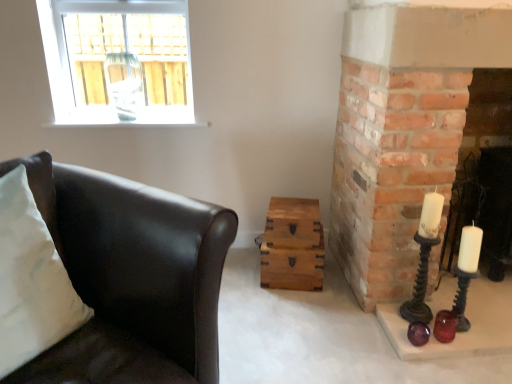
Find the location of a particular element. Image resolution: width=512 pixels, height=384 pixels. matte black leather couch at left is located at coordinates (131, 277).

Looking at this image, what is the approximate width of matte black leather couch at left?

matte black leather couch at left is 1.06 meters wide.

Describe the element at coordinates (31, 280) in the screenshot. I see `white soft cushion at left` at that location.

I want to click on translucent amber glass candle holder at lower right, which appears as the second candle holder when viewed from the top, so click(445, 326).

Locate an element on the screen. The width and height of the screenshot is (512, 384). transparent glass window at upper left is located at coordinates (118, 61).

At what (x,y) coordinates should I click in order to perform the action: click on matte black leather couch at left. Please return your answer as a coordinate pair (x, y). Looking at the image, I should click on pyautogui.click(x=131, y=277).

Is smooth brick fireplace at right smaller than transparent glass window at upper left?

No, smooth brick fireplace at right is not smaller than transparent glass window at upper left.

Is smooth brick fireplace at right not inside transparent glass window at upper left?

smooth brick fireplace at right lies outside transparent glass window at upper left's area.

The image size is (512, 384). I want to click on window on the left of smooth brick fireplace at right, so click(118, 61).

From a real-world perspective, between smooth brick fireplace at right and transparent glass window at upper left, who is vertically lower?

From a 3D spatial view, smooth brick fireplace at right is below.

From the image's perspective, between transparent glass window at upper left and white soft cushion at left, which one is located above?

transparent glass window at upper left appears higher in the image.

Is transparent glass window at upper left directly adjacent to white soft cushion at left?

No, transparent glass window at upper left is not making contact with white soft cushion at left.

Can you confirm if transparent glass window at upper left is positioned to the left of white soft cushion at left?

Indeed, transparent glass window at upper left is positioned on the left side of white soft cushion at left.

From a real-world perspective, is transparent glass window at upper left under white soft cushion at left?

No.

From a real-world perspective, is smooth brick fireplace at right above or below wooden chest at center, the 2th drawer viewed from the top?

Clearly, from a real-world perspective, smooth brick fireplace at right is above wooden chest at center, the 2th drawer viewed from the top.

From the image's perspective, does smooth brick fireplace at right appear lower than wooden chest at center, the 1th drawer in the bottom-to-top sequence?

No, from the image's perspective, smooth brick fireplace at right is not beneath wooden chest at center, the 1th drawer in the bottom-to-top sequence.

Which is more to the left, smooth brick fireplace at right or wooden chest at center, the 2th drawer viewed from the top?

wooden chest at center, the 2th drawer viewed from the top.

Considering the sizes of objects smooth brick fireplace at right and wooden chest at center, the 1th drawer in the bottom-to-top sequence, in the image provided, who is wider, smooth brick fireplace at right or wooden chest at center, the 1th drawer in the bottom-to-top sequence,?

Wider between the two is smooth brick fireplace at right.

Is transparent glass window at upper left at the left side of translucent amber glass candle holder at lower right, which appears as the second candle holder when viewed from the top?

Correct, you'll find transparent glass window at upper left to the left of translucent amber glass candle holder at lower right, which appears as the second candle holder when viewed from the top.

From the image's perspective, does transparent glass window at upper left appear higher than translucent amber glass candle holder at lower right, marked as the 1th candle holder in a bottom-to-top arrangement?

Yes, from the image's perspective, transparent glass window at upper left is over translucent amber glass candle holder at lower right, marked as the 1th candle holder in a bottom-to-top arrangement.

Are transparent glass window at upper left and translucent amber glass candle holder at lower right, which appears as the second candle holder when viewed from the top, making contact?

There is a gap between transparent glass window at upper left and translucent amber glass candle holder at lower right, which appears as the second candle holder when viewed from the top.

From a real-world perspective, is transparent glass window at upper left positioned over translucent amber glass candle holder at lower right, which appears as the second candle holder when viewed from the top, based on gravity?

Yes.

In terms of width, does translucent amber glass candle holder at lower right, marked as the 1th candle holder in a bottom-to-top arrangement, look wider or thinner when compared to matte black leather couch at left?

In the image, translucent amber glass candle holder at lower right, marked as the 1th candle holder in a bottom-to-top arrangement, appears to be more narrow than matte black leather couch at left.

Is translucent amber glass candle holder at lower right, marked as the 1th candle holder in a bottom-to-top arrangement, to the right of matte black leather couch at left from the viewer's perspective?

Indeed, translucent amber glass candle holder at lower right, marked as the 1th candle holder in a bottom-to-top arrangement, is positioned on the right side of matte black leather couch at left.

Does translucent amber glass candle holder at lower right, marked as the 1th candle holder in a bottom-to-top arrangement, have a greater height compared to matte black leather couch at left?

Incorrect, the height of translucent amber glass candle holder at lower right, marked as the 1th candle holder in a bottom-to-top arrangement, is not larger of that of matte black leather couch at left.

Find the location of a particular element. the 2nd candle holder behind when counting from the matte black leather couch at left is located at coordinates (445, 326).

Is matte black leather couch at left a part of smooth brick fireplace at right?

That's incorrect, matte black leather couch at left is not inside smooth brick fireplace at right.

Between smooth brick fireplace at right and matte black leather couch at left, which one has larger size?

Bigger between the two is matte black leather couch at left.

Is matte black leather couch at left at the back of smooth brick fireplace at right?

smooth brick fireplace at right does not have its back to matte black leather couch at left.

Would you say smooth brick fireplace at right is to the left or to the right of matte black leather couch at left in the picture?

smooth brick fireplace at right is to the right of matte black leather couch at left.

Is the surface of wooden chest at center, the 2th drawer viewed from the top, in direct contact with transparent glass window at upper left?

wooden chest at center, the 2th drawer viewed from the top, is not next to transparent glass window at upper left, and they're not touching.

Measure the distance between wooden chest at center, the 2th drawer viewed from the top, and transparent glass window at upper left.

A distance of 1.27 meters exists between wooden chest at center, the 2th drawer viewed from the top, and transparent glass window at upper left.

Is wooden chest at center, the 2th drawer viewed from the top, bigger than transparent glass window at upper left?

Incorrect, wooden chest at center, the 2th drawer viewed from the top, is not larger than transparent glass window at upper left.

Consider the image. Relative to transparent glass window at upper left, is wooden chest at center, the 2th drawer viewed from the top, in front or behind?

wooden chest at center, the 2th drawer viewed from the top, is behind transparent glass window at upper left.

Find the location of a particular element. This screenshot has height=384, width=512. window that appears on the left of smooth brick fireplace at right is located at coordinates (118, 61).

Locate an element on the screen. The image size is (512, 384). window lying above the white soft cushion at left (from the image's perspective) is located at coordinates (118, 61).

When comparing their distances from matte black leather couch at left, does transparent glass window at upper left or translucent amber glass candle holder at lower right, which appears as the second candle holder when viewed from the top, seem further?

transparent glass window at upper left is positioned further to the anchor matte black leather couch at left.

Looking at the image, which one is located further to matte black leather couch at left, transparent glass window at upper left or wooden chest at center, the 1th drawer viewed from the top?

Based on the image, transparent glass window at upper left appears to be further to matte black leather couch at left.

When comparing their distances from matte black leather couch at left, does transparent glass window at upper left or matte black candle holder at right, which is the 2th candle holder from bottom to top, seem further?

Based on the image, transparent glass window at upper left appears to be further to matte black leather couch at left.

From the image, which object appears to be nearer to translucent amber glass candle holder at lower right, which appears as the second candle holder when viewed from the top, matte black candle holder at right, which is the 2th candle holder from bottom to top, or transparent glass window at upper left?

matte black candle holder at right, which is the 2th candle holder from bottom to top.

Based on their spatial positions, is translucent amber glass candle holder at lower right, which appears as the second candle holder when viewed from the top, or white soft cushion at left further from matte black candle holder at right, which is the 2th candle holder from bottom to top?

white soft cushion at left is further to matte black candle holder at right, which is the 2th candle holder from bottom to top.

Consider the image. Considering their positions, is matte black candle holder at right, which is the 2th candle holder from bottom to top, positioned further to transparent glass window at upper left than translucent amber glass candle holder at lower right, marked as the 1th candle holder in a bottom-to-top arrangement?

The object further to transparent glass window at upper left is translucent amber glass candle holder at lower right, marked as the 1th candle holder in a bottom-to-top arrangement.

Based on their spatial positions, is matte black candle holder at right, which is the 2th candle holder from bottom to top, or translucent amber glass candle holder at lower right, marked as the 1th candle holder in a bottom-to-top arrangement, further from wooden chest at center, the 1th drawer viewed from the top?

Among the two, translucent amber glass candle holder at lower right, marked as the 1th candle holder in a bottom-to-top arrangement, is located further to wooden chest at center, the 1th drawer viewed from the top.

In the scene shown: Considering their positions, is transparent glass window at upper left positioned closer to white soft cushion at left than wooden chest at center, the 1th drawer in the bottom-to-top sequence?

wooden chest at center, the 1th drawer in the bottom-to-top sequence, is closer to white soft cushion at left.

Find the location of a particular element. pillow situated between transparent glass window at upper left and translucent amber glass candle holder at lower right, marked as the 1th candle holder in a bottom-to-top arrangement, from left to right is located at coordinates (31, 280).

This screenshot has width=512, height=384. What are the coordinates of `pillow between matte black leather couch at left and wooden chest at center, the 2th drawer viewed from the top, from front to back` in the screenshot? It's located at (31, 280).

Where is `candle holder between wooden chest at center, the 2th drawer viewed from the top, and translucent amber glass candle holder at lower right, which appears as the second candle holder when viewed from the top, in the horizontal direction`? candle holder between wooden chest at center, the 2th drawer viewed from the top, and translucent amber glass candle holder at lower right, which appears as the second candle holder when viewed from the top, in the horizontal direction is located at coordinates pos(424,258).

Find the location of a particular element. The image size is (512, 384). studio couch situated between transparent glass window at upper left and translucent amber glass candle holder at lower right, which appears as the second candle holder when viewed from the top, from left to right is located at coordinates (131, 277).